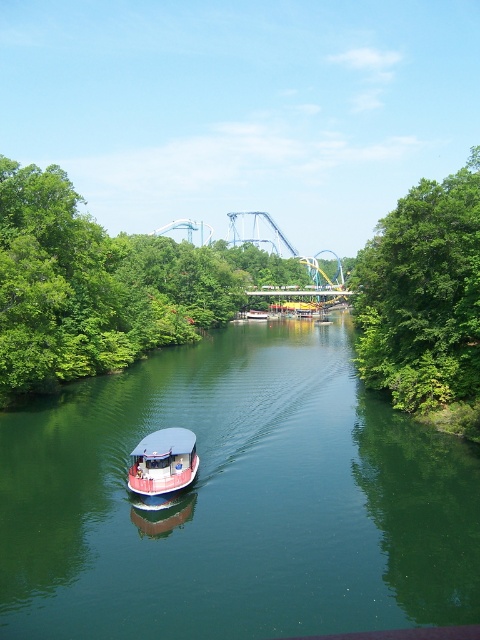
Question: Which is farther from the green smooth water at center?

Choices:
 (A) white matte boat at center
 (B) green leafy tree at right
 (C) metallic blue roller coaster at center
 (D) white glossy boat at center

Answer: (C)

Question: Which point is farther to the camera?

Choices:
 (A) white glossy boat at center
 (B) white matte boat at center

Answer: (A)

Question: Is green smooth water at center positioned in front of metallic blue roller coaster at center?

Choices:
 (A) yes
 (B) no

Answer: (A)

Question: Which point is farther from the camera taking this photo?

Choices:
 (A) (252, 310)
 (B) (372, 458)
 (C) (414, 241)

Answer: (A)

Question: Does white matte boat at center have a smaller size compared to white glossy boat at center?

Choices:
 (A) no
 (B) yes

Answer: (B)

Question: Is metallic blue roller coaster at center further to camera compared to white glossy boat at center?

Choices:
 (A) yes
 (B) no

Answer: (B)